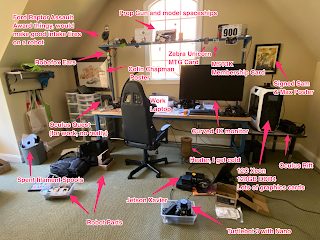
Locate an element on the screen. The height and width of the screenshot is (240, 320). computer monitor is located at coordinates (207, 84).